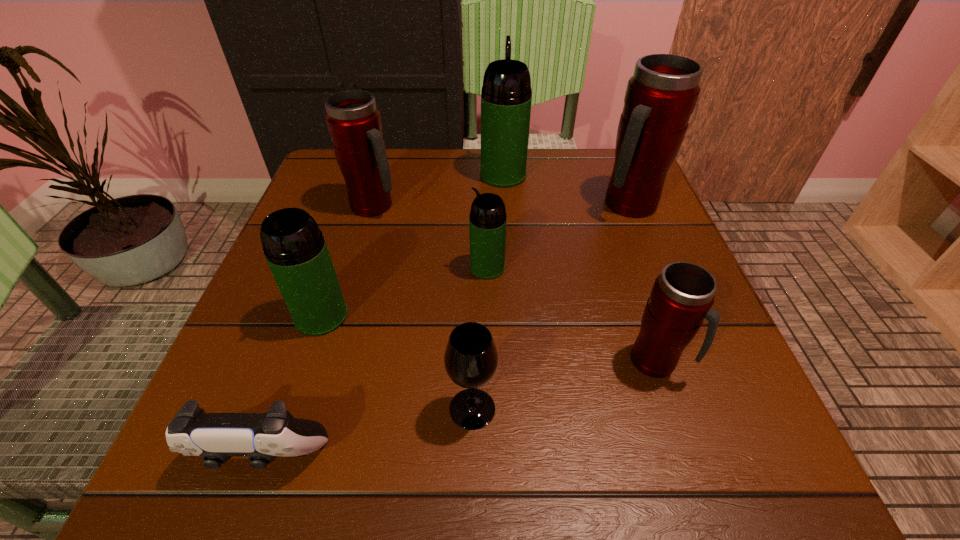
This screenshot has height=540, width=960. What are the coordinates of `the nearest object` in the screenshot? It's located at (216, 437).

Image resolution: width=960 pixels, height=540 pixels. I want to click on control, so click(x=216, y=437).

The width and height of the screenshot is (960, 540). In order to click on vacant space located on the side with the handle of the biggest red thermos bottle in this screenshot , I will do `click(663, 291)`.

Image resolution: width=960 pixels, height=540 pixels. Identify the location of free spot located 0.070m from the spout of the nearest green thermos bottle. (302, 373).

At what (x,y) coordinates should I click in order to perform the action: click on free location located 0.270m on the side with the handle of the leftmost red thermos bottle. Please return your answer as a coordinate pair (x, y). Looking at the image, I should click on (521, 206).

Find the location of `vacant space located 0.350m from the spout of the second farthest green thermos bottle`. vacant space located 0.350m from the spout of the second farthest green thermos bottle is located at coordinates (286, 267).

Image resolution: width=960 pixels, height=540 pixels. Find the location of `free region located 0.250m from the spout of the second farthest green thermos bottle`. free region located 0.250m from the spout of the second farthest green thermos bottle is located at coordinates (339, 267).

At what (x,y) coordinates should I click in order to perform the action: click on vacant space located 0.110m from the spout of the second farthest green thermos bottle. Please return your answer as a coordinate pair (x, y). The height and width of the screenshot is (540, 960). Looking at the image, I should click on (412, 267).

Find the location of `vacant space positioned on the side with the handle of the nearest thermos bottle`. vacant space positioned on the side with the handle of the nearest thermos bottle is located at coordinates (729, 361).

At what (x,y) coordinates should I click in order to perform the action: click on free spot located on the back of the seventh farthest object. Please return your answer as a coordinate pair (x, y). The height and width of the screenshot is (540, 960). Looking at the image, I should click on (474, 279).